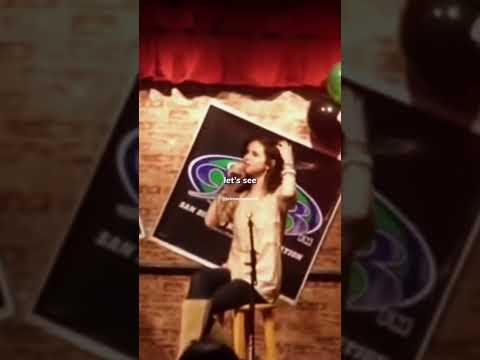
At what (x,y) coordinates should I click in order to perform the action: click on wooden stool. Please return your answer as a coordinate pair (x, y). Looking at the image, I should click on (268, 330).